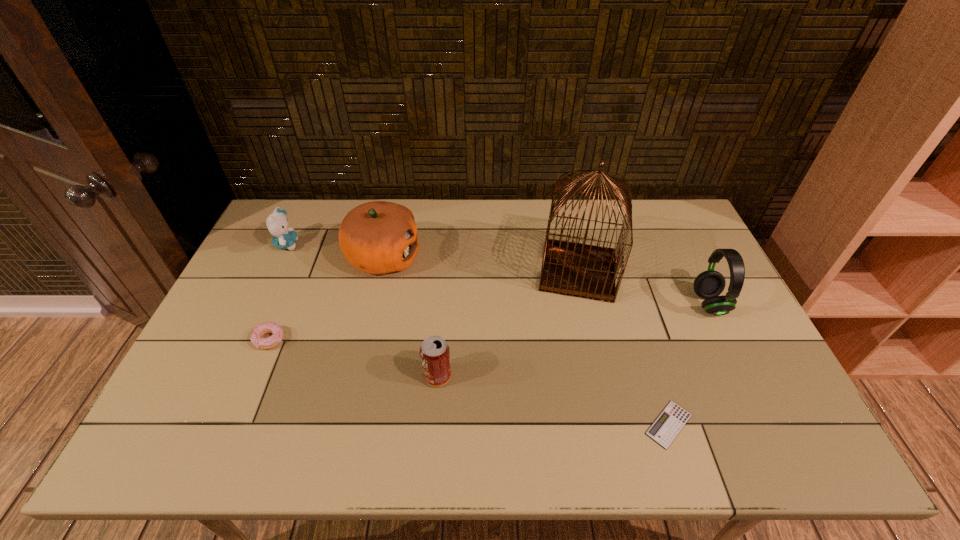
Where is `kitten at the far edge`? Image resolution: width=960 pixels, height=540 pixels. kitten at the far edge is located at coordinates (277, 223).

This screenshot has height=540, width=960. In order to click on object located in the near edge section of the desktop in this screenshot , I will do `click(666, 427)`.

Find the location of `kitten present at the left edge`. kitten present at the left edge is located at coordinates (277, 223).

Identify the location of doughnut positioned at the left edge. (256, 338).

You are a GUI agent. You are given a task and a screenshot of the screen. Output one action in this format:
    pyautogui.click(x=<x>, y=<y>)
    Task: Click on the object that is at the right edge
    
    Given the screenshot: What is the action you would take?
    pyautogui.click(x=709, y=284)

At what (x,y) coordinates should I click in order to perform the action: click on object at the far left corner. Please return your answer as a coordinate pair (x, y). Image resolution: width=960 pixels, height=540 pixels. Looking at the image, I should click on (277, 223).

In the image, there is a desktop. In order to click on free region at the far edge in this screenshot , I will do click(x=337, y=240).

At what (x,y) coordinates should I click in order to perform the action: click on vacant space at the left edge of the desktop. Please return your answer as a coordinate pair (x, y). Looking at the image, I should click on (287, 249).

In the image, there is a desktop. Where is `vacant area at the right edge`? The width and height of the screenshot is (960, 540). vacant area at the right edge is located at coordinates (685, 265).

Identify the location of vacant space at the near left corner of the desktop. This screenshot has width=960, height=540. (172, 431).